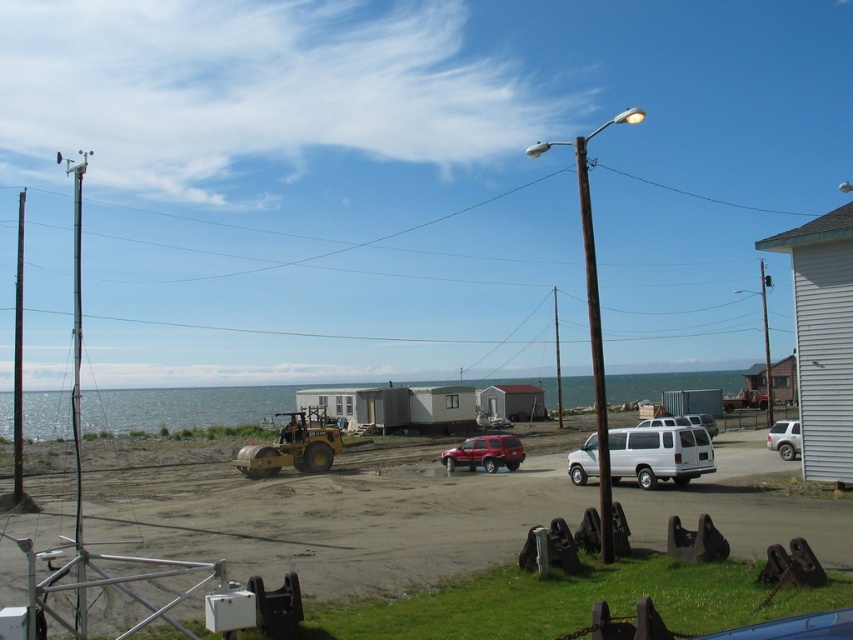
Question: Considering the real-world distances, which object is closest to the black wire at upper center?

Choices:
 (A) brown wooden pole at center
 (B) matte yellow road roller at center
 (C) white matte car at right

Answer: (A)

Question: Which of these objects is positioned farthest from the metallic pole at center?

Choices:
 (A) metallic pole at right
 (B) black wire at upper center
 (C) white matte van at center-right

Answer: (B)

Question: Observing the image, what is the correct spatial positioning of blue water at center in reference to metallic pole at center?

Choices:
 (A) above
 (B) below

Answer: (B)

Question: Observing the image, what is the correct spatial positioning of blue water at center in reference to metallic pole at right?

Choices:
 (A) below
 (B) above

Answer: (A)

Question: Is matte yellow road roller at center bigger than black wire at upper center?

Choices:
 (A) yes
 (B) no

Answer: (B)

Question: Among these points, which one is nearest to the camera?

Choices:
 (A) (762, 310)
 (B) (491, 470)
 (C) (311, 435)
 (D) (558, 417)

Answer: (B)